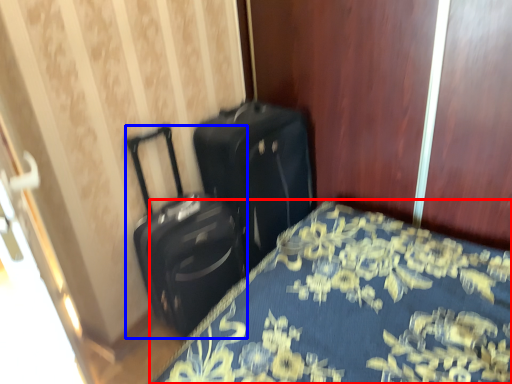
Question: Which object is further to the camera taking this photo, bed (highlighted by a red box) or suitcase (highlighted by a blue box)?

Choices:
 (A) bed
 (B) suitcase

Answer: (B)